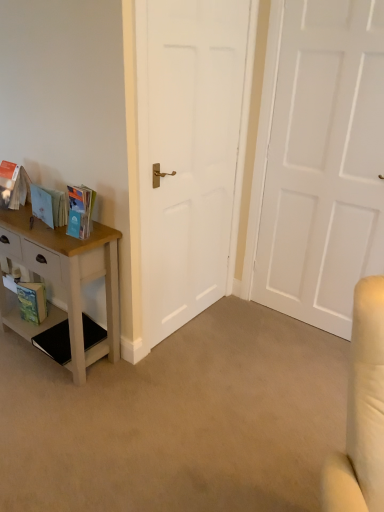
The height and width of the screenshot is (512, 384). Find the location of `vacant area that is in front of white painted wood nightstand at left`. vacant area that is in front of white painted wood nightstand at left is located at coordinates tap(54, 409).